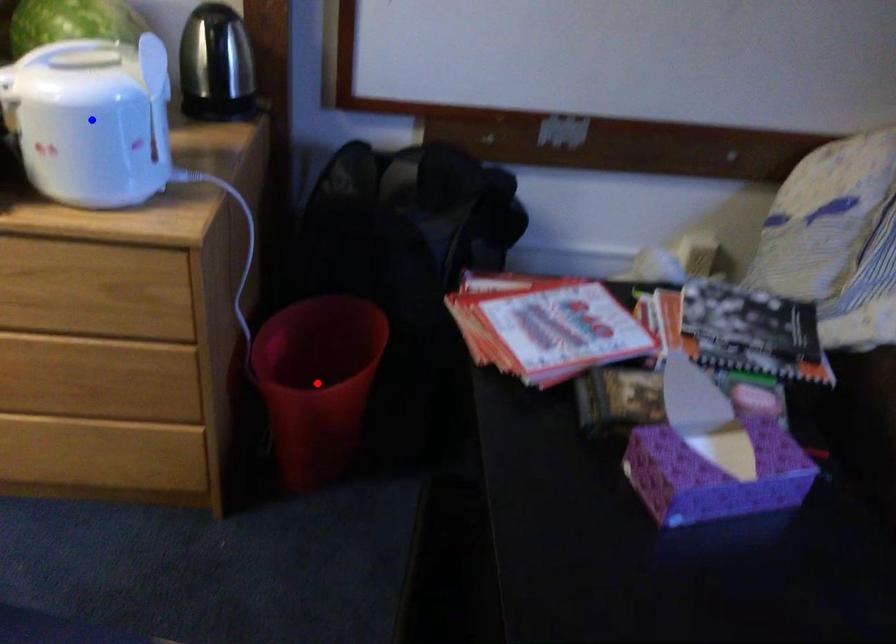
Question: Which of the two points in the image is closer to the camera?

Choices:
 (A) Blue point is closer.
 (B) Red point is closer.

Answer: (A)